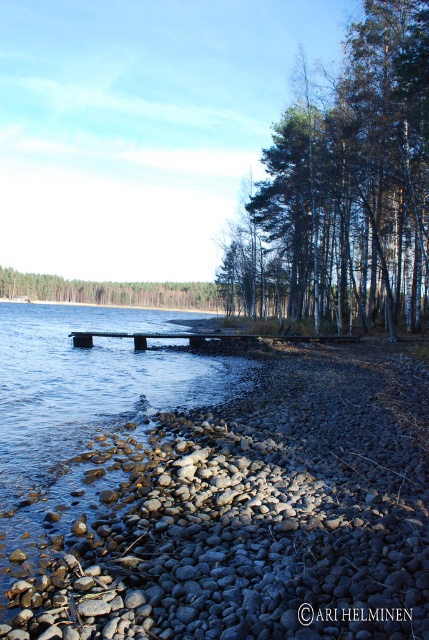
You are standing at the edge of the lake and notice the gray smooth rocks at lower center. According to the coordinates provided, where exactly are these rocks located in the image?

The gray smooth rocks at lower center are located at coordinates point (253, 516).

You are an environmental scientist assessing tree health in the lakeside area. You observe two groups of green leafy trees at right and green leafy trees at center. Based on their thickness, which group might have a younger age or less developed root system?

The green leafy trees at right is thinner than green leafy trees at center, so the trees at right might have a younger age or less developed root system.

You are a landscape photographer planning to capture the reflection of the green leafy trees at center in the water. The gray smooth rocks at lower center might interfere with the reflection. Which object is smaller and thus less likely to disrupt the reflection?

The gray smooth rocks at lower center is smaller than the green leafy trees at center, so it is less likely to disrupt the reflection.